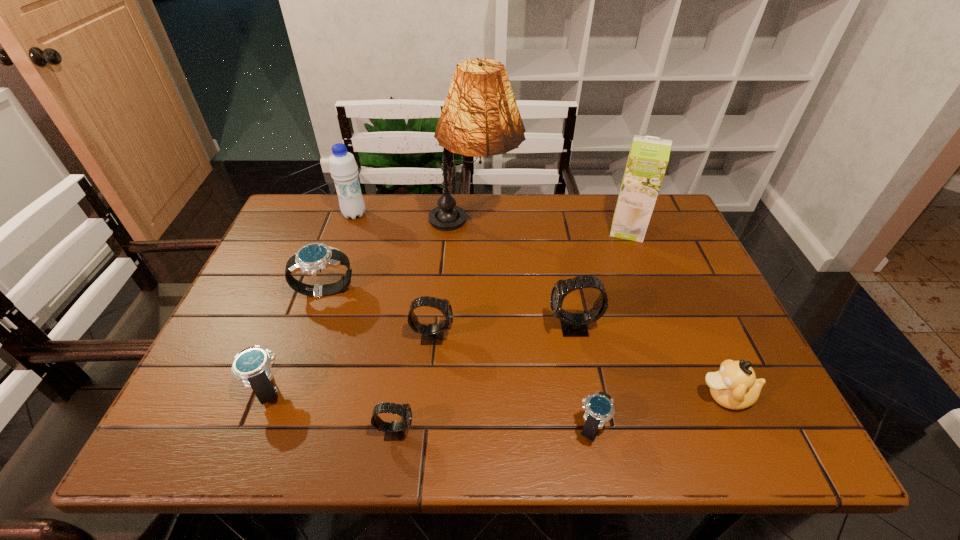
At what (x,y) coordinates should I click in order to perform the action: click on vacant region at the left edge. Please return your answer as a coordinate pair (x, y). Looking at the image, I should click on (276, 329).

Identify the location of vacant space at the right edge of the desktop. (770, 401).

Where is `free spot at the far left corner of the desktop`? Image resolution: width=960 pixels, height=540 pixels. free spot at the far left corner of the desktop is located at coordinates (339, 217).

Where is `free space at the far right corner of the desktop`? Image resolution: width=960 pixels, height=540 pixels. free space at the far right corner of the desktop is located at coordinates (655, 214).

Where is `unoccupied area between the lampshade and the eighth shortest object`? The width and height of the screenshot is (960, 540). unoccupied area between the lampshade and the eighth shortest object is located at coordinates (414, 220).

Locate an element on the screen. The image size is (960, 540). vacant space that is in between the smallest gray watch and the second biggest silver watch is located at coordinates (331, 410).

The width and height of the screenshot is (960, 540). Identify the location of vacant space in between the farthest watch and the second tallest object. (476, 261).

Locate an element on the screen. The height and width of the screenshot is (540, 960). free space between the second smallest gray watch and the duckling is located at coordinates (579, 366).

You are a GUI agent. You are given a task and a screenshot of the screen. Output one action in this format:
    pyautogui.click(x=<x>, y=<y>)
    Task: Click on the free spot between the lampshade and the water bottle
    
    Given the screenshot: What is the action you would take?
    pyautogui.click(x=414, y=220)

The height and width of the screenshot is (540, 960). Identify the location of unoccupied position between the second smallest silver watch and the seventh nearest object. (296, 341).